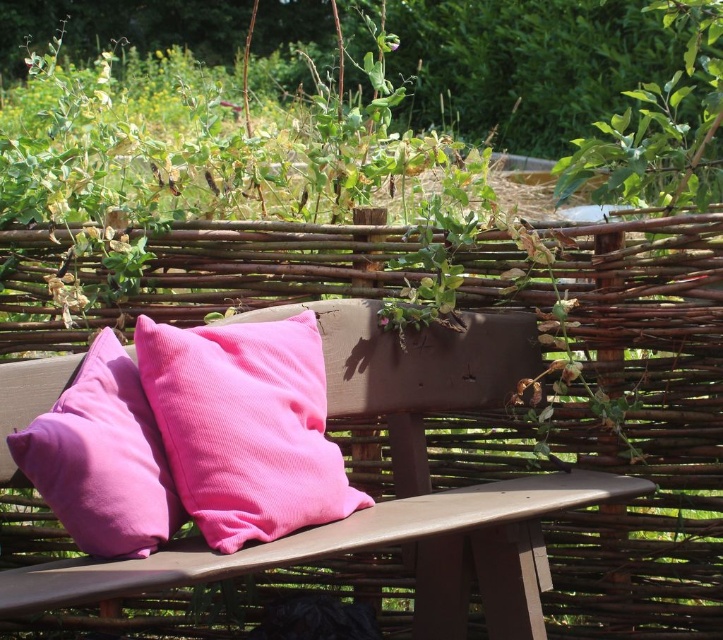
Between matte wood park bench at center and pink corduroy pillow at left, which one is positioned higher?

pink corduroy pillow at left

Does point (299, 556) come farther from viewer compared to point (129, 557)?

No, it is not.

Who is more forward, (461, 561) or (127, 419)?

Point (127, 419) is more forward.

The height and width of the screenshot is (640, 723). Identify the location of matte wood park bench at center. (393, 483).

Is point (474, 408) behind point (325, 465)?

Yes, point (474, 408) is farther from viewer.

Can you confirm if matte wood park bench at center is smaller than pink corduroy pillow at center?

Incorrect, matte wood park bench at center is not smaller in size than pink corduroy pillow at center.

This screenshot has height=640, width=723. What are the coordinates of `matte wood park bench at center` in the screenshot? It's located at (393, 483).

Who is more forward, [175,445] or [38,465]?

Positioned in front is point [38,465].

Who is positioned more to the left, pink corduroy pillow at center or pink corduroy pillow at left?

pink corduroy pillow at left is more to the left.

Locate an element on the screen. The height and width of the screenshot is (640, 723). pink corduroy pillow at center is located at coordinates (244, 426).

Locate an element on the screen. Image resolution: width=723 pixels, height=640 pixels. pink corduroy pillow at center is located at coordinates (244, 426).